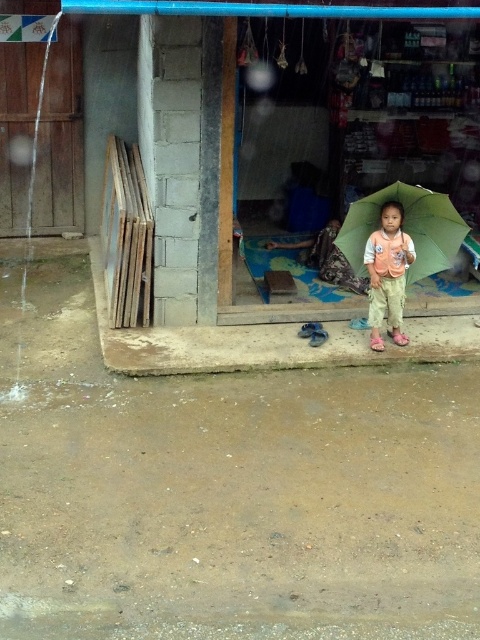
You are a customer entering the shop and see the green matte umbrella at center and the matte orange vest at center. Which item is bigger in size?

The green matte umbrella at center is larger in size compared to the matte orange vest at center.

You are standing outside the shop and want to check if the point at coordinates (407, 227) is on the green matte umbrella at center. Can you confirm this?

Yes, the point at coordinates (407, 227) is on the green matte umbrella at center according to the description.